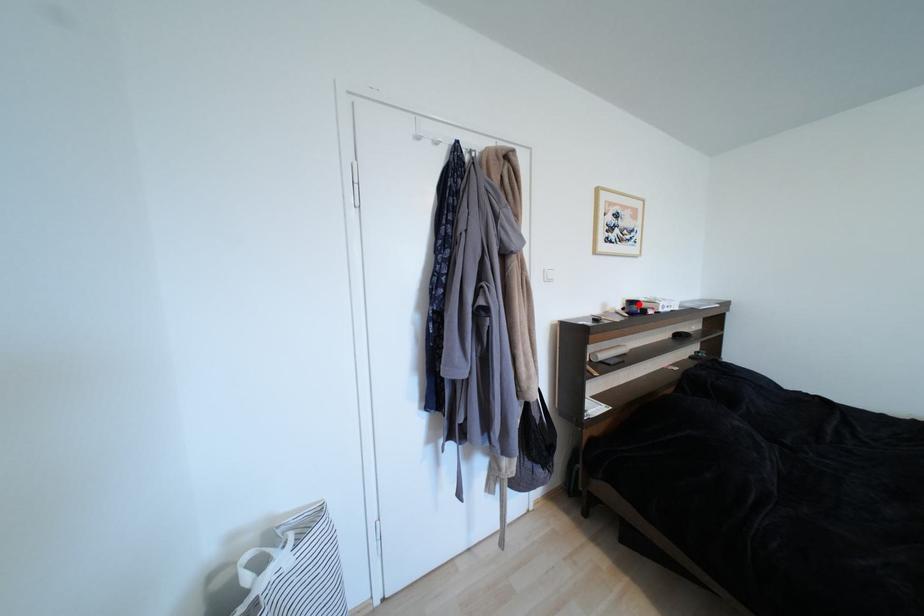
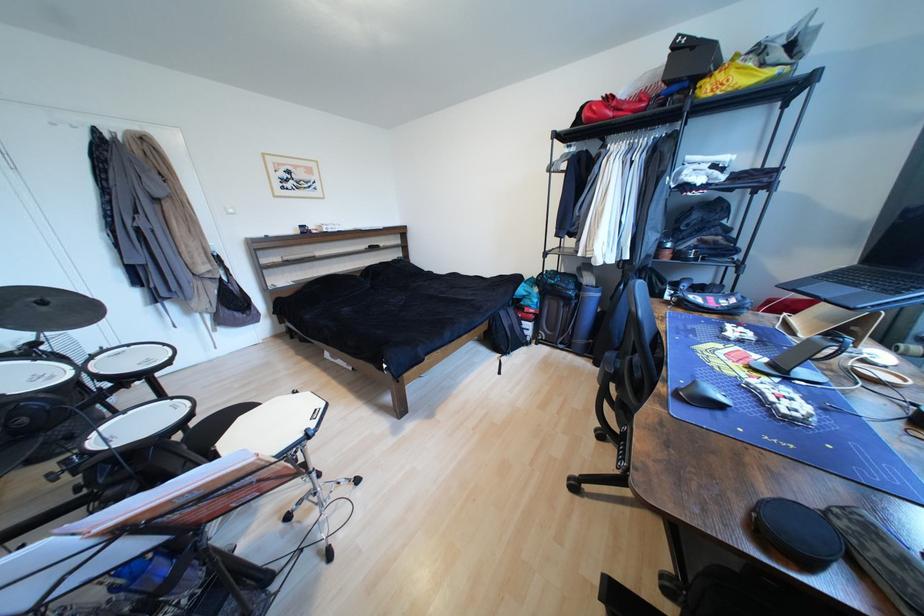
Question: A red point is marked in image1. In image2, is the corresponding 3D point closer to the camera or farther? Reply with the corresponding letter.

Choices:
 (A) The corresponding 3D point is closer.
 (B) The corresponding 3D point is farther.

Answer: (A)